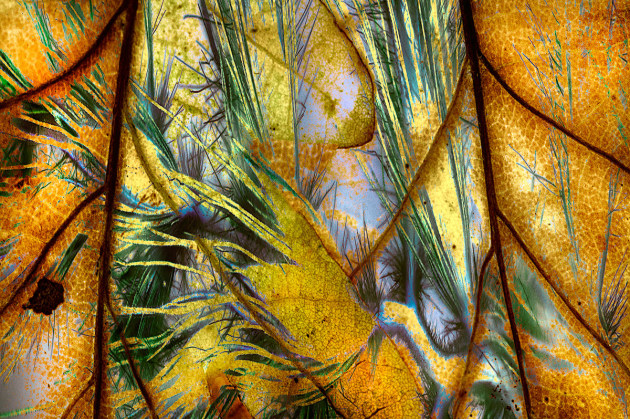
This screenshot has height=419, width=630. What are the coordinates of `green plants` in the screenshot? It's located at (159, 132), (150, 296), (238, 106).